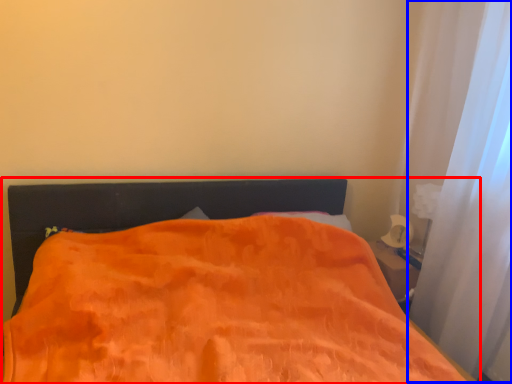
Question: Which of the following is the closest to the observer, bed (highlighted by a red box) or curtain (highlighted by a blue box)?

Choices:
 (A) bed
 (B) curtain

Answer: (A)